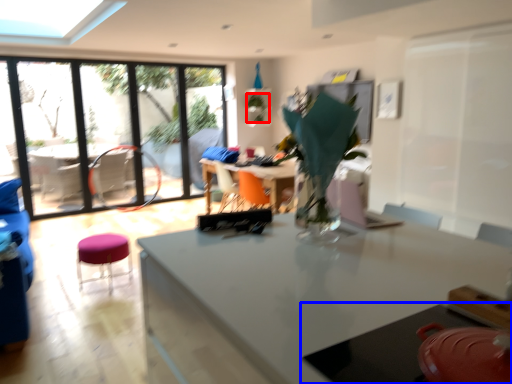
Question: Which object appears closest to the camera in this image, plant (highlighted by a red box) or table (highlighted by a blue box)?

Choices:
 (A) plant
 (B) table

Answer: (B)